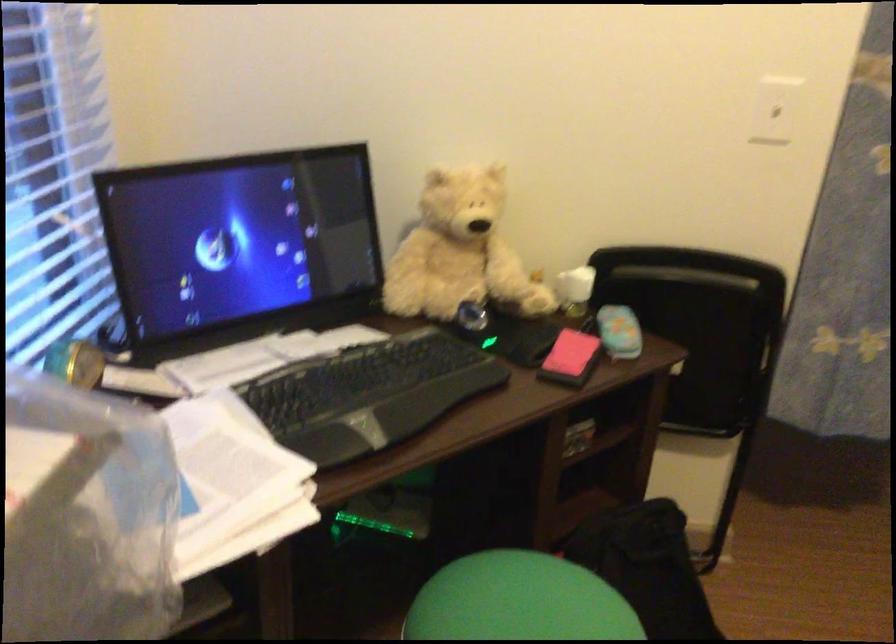
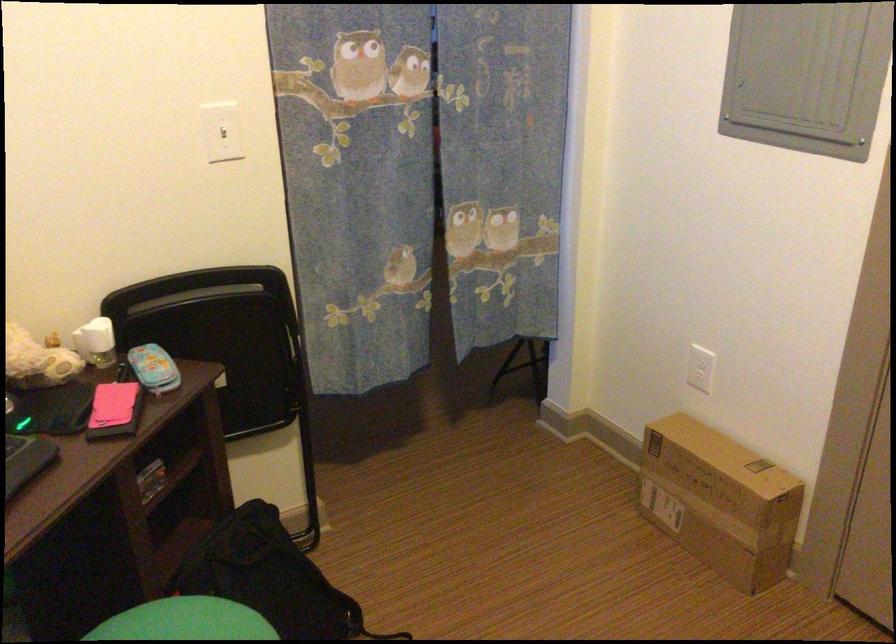
The point at (x=573, y=357) is marked in the first image. Where is the corresponding point in the second image?

(114, 410)